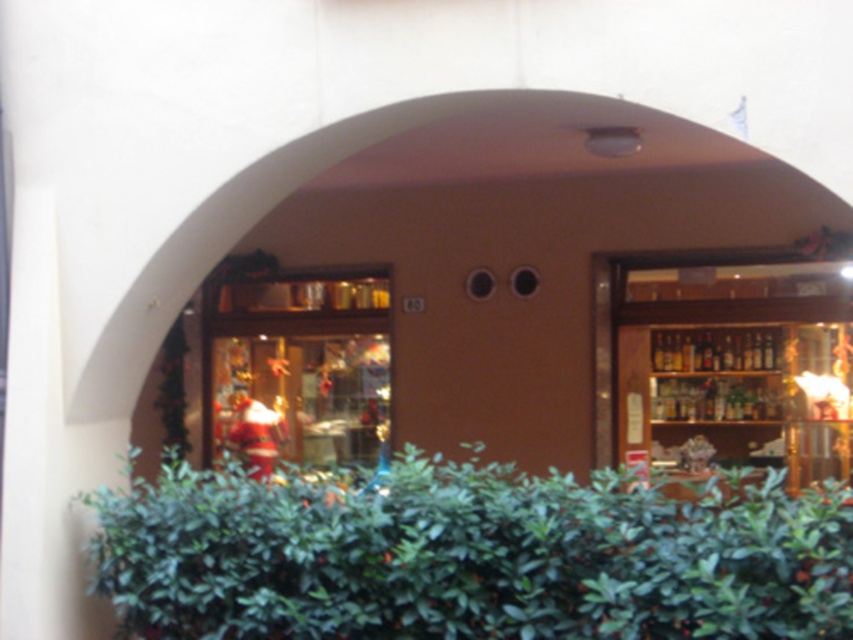
Which is in front, point (541, 548) or point (252, 408)?

Point (541, 548) is in front.

Who is taller, green leafy hedge at lower center or santa claus figure at center?

Standing taller between the two is santa claus figure at center.

Locate an element on the screen. green leafy hedge at lower center is located at coordinates (471, 556).

The image size is (853, 640). I want to click on green leafy hedge at lower center, so click(471, 556).

Is green leafy hedge at lower center bigger than wooden shelves at center?

Yes.

Locate an element on the screen. The height and width of the screenshot is (640, 853). green leafy hedge at lower center is located at coordinates (471, 556).

Is wooden shelves at center thinner than santa claus figure at center?

Indeed, wooden shelves at center has a lesser width compared to santa claus figure at center.

Is point (804, 483) positioned behind point (312, 388)?

Yes.

What do you see at coordinates (735, 365) in the screenshot?
I see `wooden shelves at center` at bounding box center [735, 365].

Image resolution: width=853 pixels, height=640 pixels. Identify the location of wooden shelves at center. (735, 365).